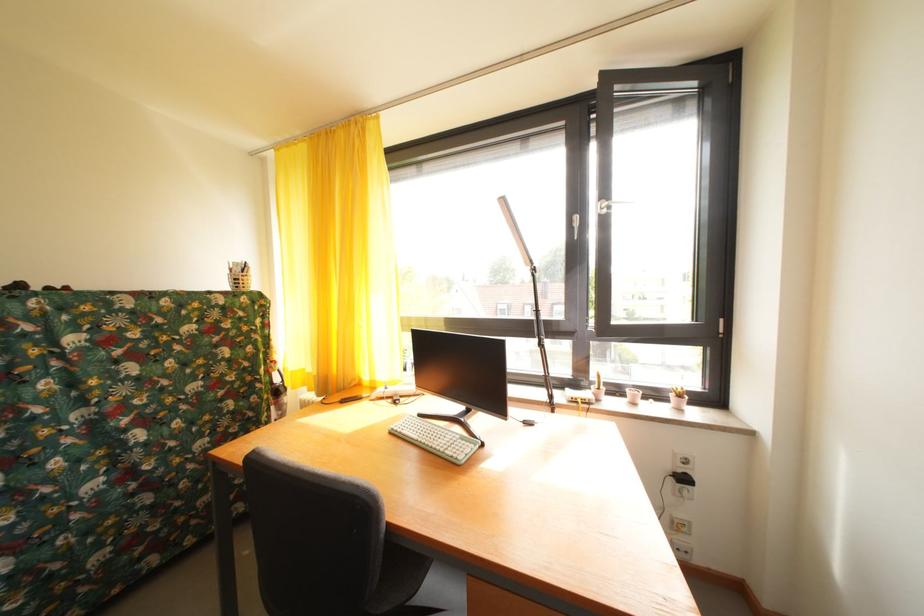
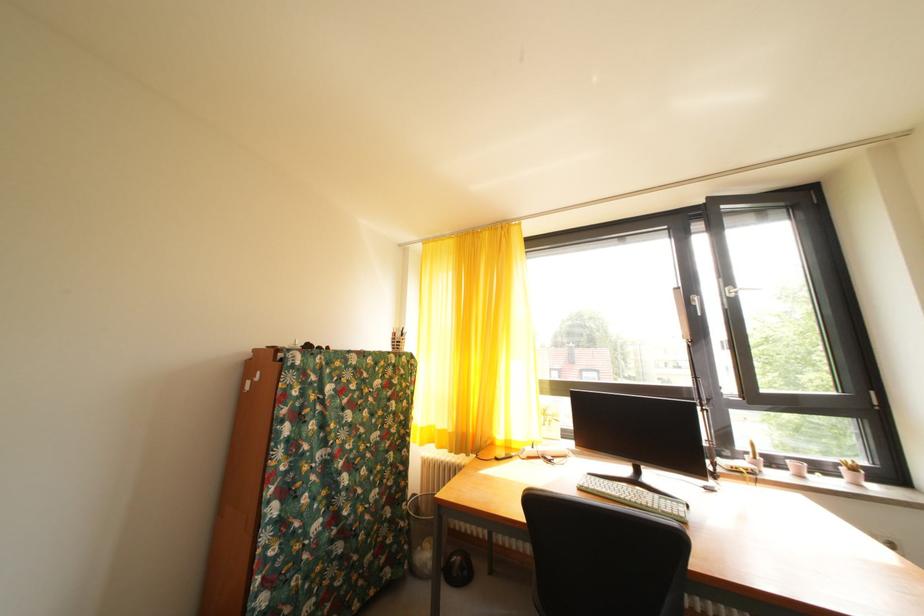
From the picture: The images are taken continuously from a first-person perspective. In which direction are you moving?

The cameraman moved toward left, backward.